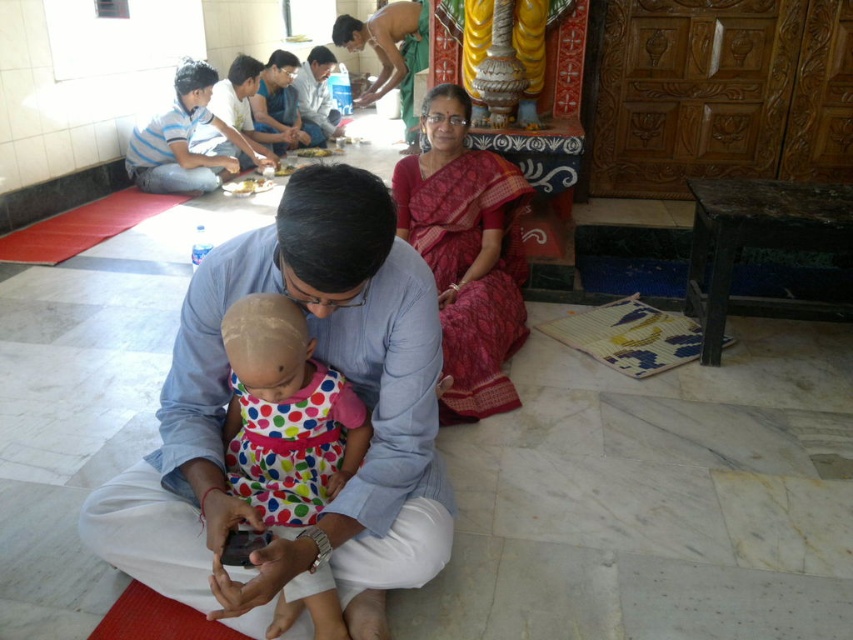
Is point (106, 531) positioned in front of point (225, 182)?

Yes, it is.

Locate an element on the screen. This screenshot has width=853, height=640. blue cotton shirt at center is located at coordinates (326, 364).

Does point (416, 365) come in front of point (263, 179)?

Yes, point (416, 365) is in front of point (263, 179).

The width and height of the screenshot is (853, 640). I want to click on blue cotton shirt at center, so click(326, 364).

Can you confirm if red silk saree at center is positioned below white matte food at center?

Yes.

How much distance is there between red silk saree at center and white matte food at center?

red silk saree at center and white matte food at center are 7.62 feet apart.

Is point (469, 332) less distant than point (268, 179)?

That is True.

Find the location of `red silk saree at center`. red silk saree at center is located at coordinates (466, 252).

Does polka dot fabric dress at center appear on the right side of white matte food at center?

Yes, polka dot fabric dress at center is to the right of white matte food at center.

Does point (302, 401) lie behind point (250, 177)?

No, (302, 401) is in front of (250, 177).

Is point (297, 324) positioned after point (245, 186)?

No, (297, 324) is in front of (245, 186).

The width and height of the screenshot is (853, 640). What are the coordinates of `polka dot fabric dress at center` in the screenshot? It's located at (285, 417).